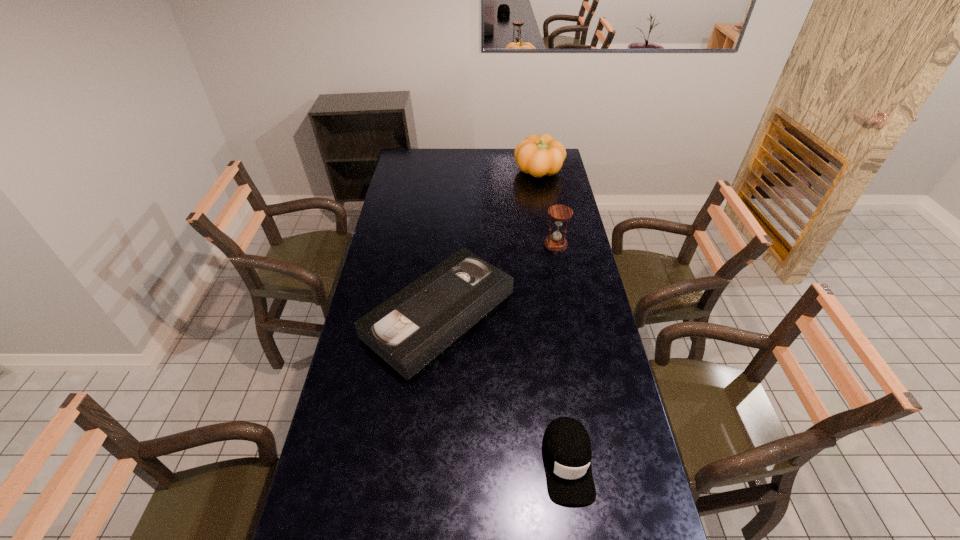
The height and width of the screenshot is (540, 960). I want to click on the farthest object, so click(x=541, y=155).

Image resolution: width=960 pixels, height=540 pixels. In order to click on the tallest object in this screenshot , I will do `click(541, 155)`.

The image size is (960, 540). Find the location of `hourglass`. hourglass is located at coordinates (556, 242).

This screenshot has width=960, height=540. I want to click on the second tallest object, so click(x=556, y=242).

In order to click on the second shortest object in this screenshot , I will do `click(566, 446)`.

What are the coordinates of `the nearest object` in the screenshot? It's located at (566, 446).

Find the location of `the third farthest object`. the third farthest object is located at coordinates (411, 328).

At what (x,y) coordinates should I click in order to perform the action: click on the leftmost object. Please return your answer as a coordinate pair (x, y). Looking at the image, I should click on (411, 328).

Where is `vacant space located 0.180m on the left of the pumpkin`? The height and width of the screenshot is (540, 960). vacant space located 0.180m on the left of the pumpkin is located at coordinates (480, 172).

Where is `vacant area located 0.300m on the left of the third shortest object`? This screenshot has width=960, height=540. vacant area located 0.300m on the left of the third shortest object is located at coordinates (475, 244).